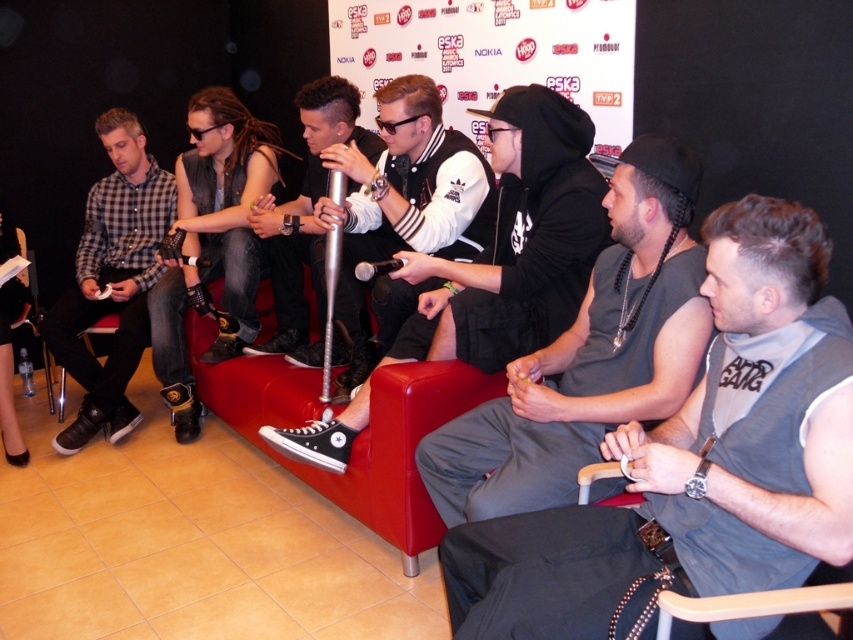
Question: Which object appears farthest from the camera in this image?

Choices:
 (A) gray cotton hoodie at center
 (B) wooden at lower right

Answer: (A)

Question: In this image, where is black leather jacket at center located relative to wooden at lower right?

Choices:
 (A) below
 (B) above

Answer: (B)

Question: Which of these objects is positioned farthest from the wooden at lower right?

Choices:
 (A) matte black sneakers at left
 (B) black canvas shoe at center
 (C) black leather jacket at center
 (D) gray fabric vest at center

Answer: (A)

Question: Considering the real-world distances, which object is farthest from the red leather couch at center?

Choices:
 (A) gray cotton hoodie at center
 (B) leather vest at center

Answer: (A)

Question: Is red leather couch at center thinner than white leather jacket at center?

Choices:
 (A) no
 (B) yes

Answer: (A)

Question: In this image, where is gray cotton hoodie at center located relative to red leather couch at center?

Choices:
 (A) right
 (B) left

Answer: (A)